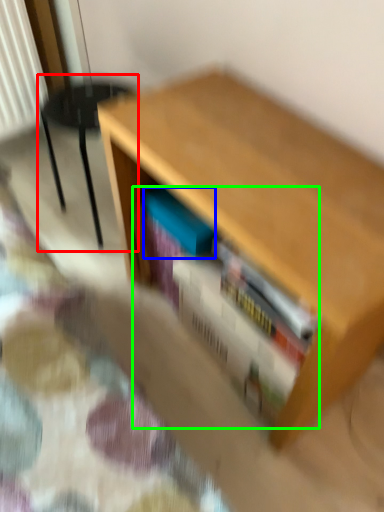
Question: Estimate the real-world distances between objects in this image. Which object is closer to armchair (highlighted by a red box), paperback book (highlighted by a blue box) or book (highlighted by a green box)?

Choices:
 (A) paperback book
 (B) book

Answer: (A)